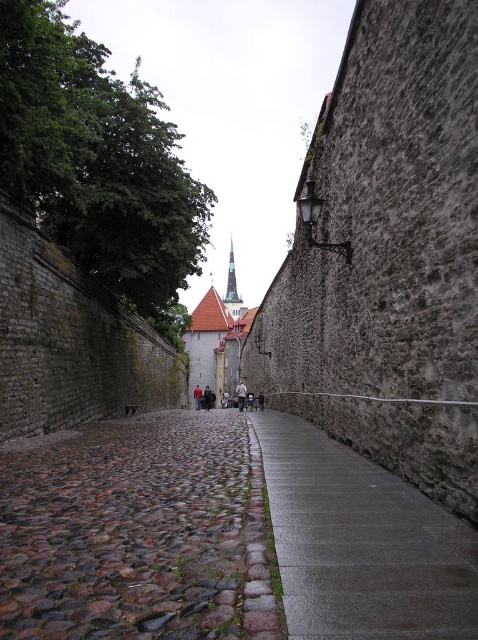
Who is positioned more to the left, gray concrete pavement at center or smooth gray stone tower at center?

Positioned to the left is smooth gray stone tower at center.

From the picture: Can you confirm if gray concrete pavement at center is wider than smooth gray stone tower at center?

Incorrect, gray concrete pavement at center's width does not surpass smooth gray stone tower at center's.

Is point (355, 470) more distant than point (228, 291)?

No, it is in front of (228, 291).

I want to click on gray concrete pavement at center, so click(360, 544).

Who is more distant from viewer, [77,524] or [229,305]?

The point [229,305] is behind.

The image size is (478, 640). In order to click on brown cobblestone pavement at center in this screenshot , I will do `click(138, 532)`.

Can you confirm if brown cobblestone pavement at center is positioned above gray concrete pavement at center?

No.

Is brown cobblestone pavement at center behind gray concrete pavement at center?

Yes, it is.

Describe the element at coordinates (138, 532) in the screenshot. The image size is (478, 640). I see `brown cobblestone pavement at center` at that location.

Where is `brown cobblestone pavement at center`? The image size is (478, 640). brown cobblestone pavement at center is located at coordinates (138, 532).